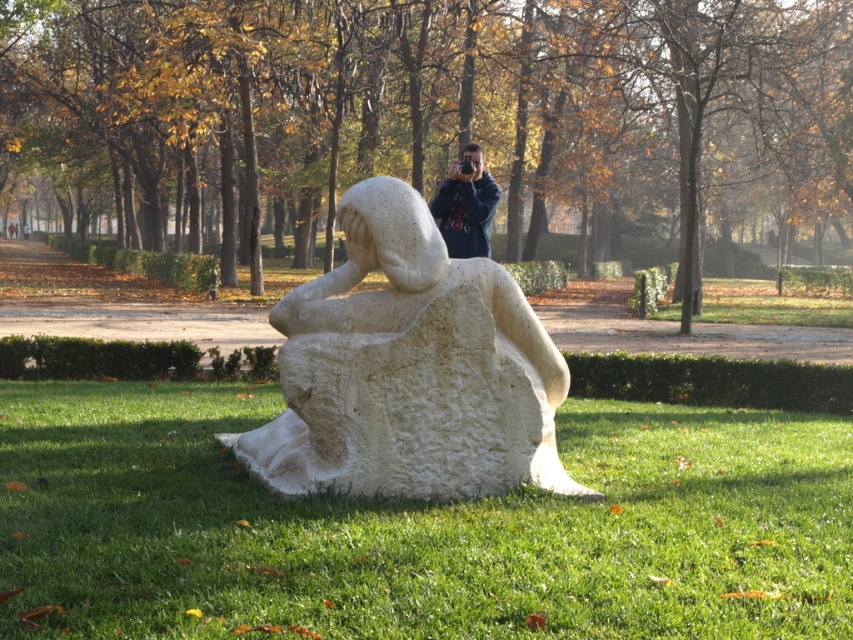
You are a gardener who needs to mow the green grass at lower center and clean the white stone sculpture at center. Which area requires more attention to detail due to its size?

The green grass at lower center requires more attention to detail because it is thinner than the white stone sculpture at center, meaning it might be a smaller area that needs precise care.

You are standing at the center of the park and want to walk towards the green grass at lower center. Based on its 2D coordinates, in which direction should you move?

The green grass at lower center is located at coordinates 0.825 on the x axis and 0.491 on the y axis. Since the lower center position has a higher x value, you should move towards the right direction to reach it.

You are a gardener who needs to mow the green grass at lower center and clean the white stone sculpture at center. Based on the scene description, which task would require more time and effort? Explain your reasoning.

The white stone sculpture at center would require more time and effort because it is larger than the green grass at lower center. Cleaning a large stone sculpture with a rough texture likely involves more detailed work compared to mowing a smaller area of grass.